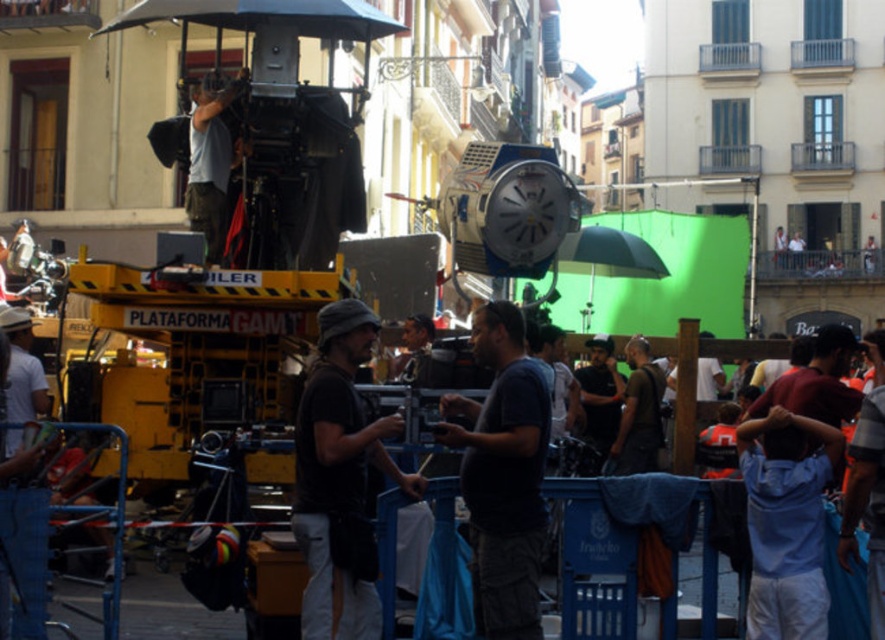
Is black fabric bag at center closer to camera compared to green matte umbrella at center?

That is True.

Can you confirm if black fabric bag at center is wider than green matte umbrella at center?

Incorrect, black fabric bag at center's width does not surpass green matte umbrella at center's.

The image size is (885, 640). In order to click on black fabric bag at center in this screenshot , I will do `click(340, 480)`.